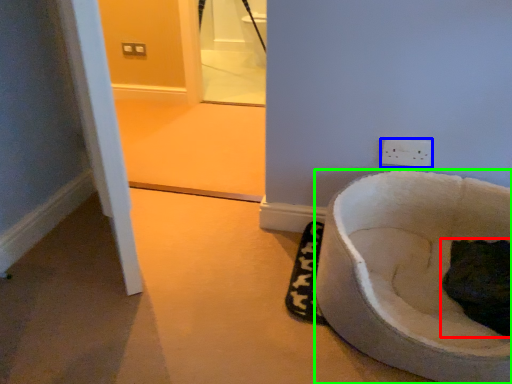
Question: Which object is positioned closest to cat (highlighted by a red box)? Select from power plugs and sockets (highlighted by a blue box) and toilet (highlighted by a green box).

Choices:
 (A) power plugs and sockets
 (B) toilet

Answer: (B)